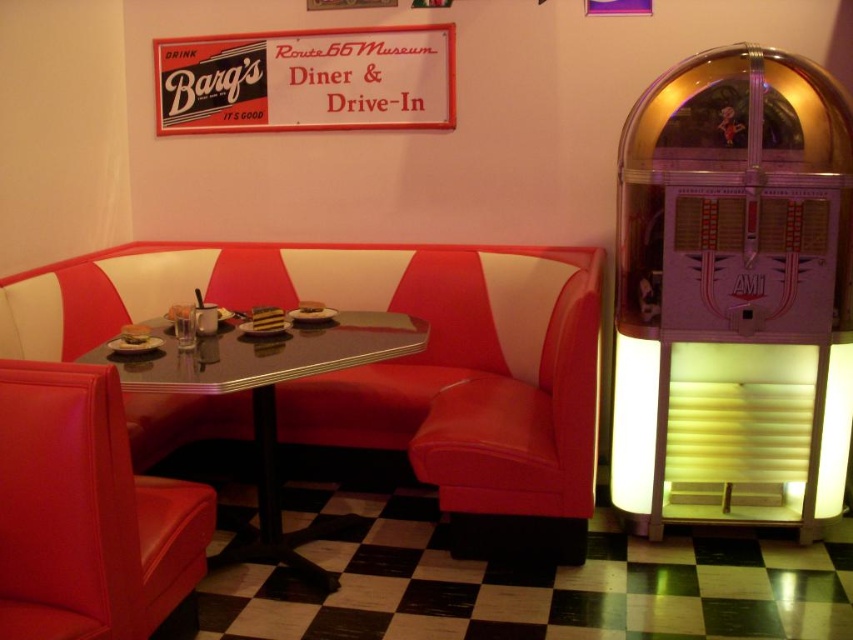
Consider the image. Does matte red leather armchair at center appear on the left side of shiny black table at center?

No, matte red leather armchair at center is not to the left of shiny black table at center.

Does point (474, 540) come farther from viewer compared to point (194, 355)?

Yes.

Which is in front, point (442, 406) or point (357, 524)?

Positioned in front is point (442, 406).

Where is `matte red leather armchair at center`? The width and height of the screenshot is (853, 640). matte red leather armchair at center is located at coordinates (521, 440).

Looking at this image, how far apart are matte red leather armchair at center and white cardboard sign at upper center?

1.53 meters

Does point (474, 499) come in front of point (172, 48)?

Yes.

What do you see at coordinates (521, 440) in the screenshot?
I see `matte red leather armchair at center` at bounding box center [521, 440].

Identify the location of matte red leather armchair at center. (521, 440).

Between matte red armchair at lower left and shiny black table at center, which one appears on the left side from the viewer's perspective?

matte red armchair at lower left

Is point (42, 410) positioned in front of point (271, 339)?

Yes, it is.

Is point (142, 548) closer to viewer compared to point (91, 356)?

Yes.

Find the location of `matte red armchair at lower left`. matte red armchair at lower left is located at coordinates (86, 513).